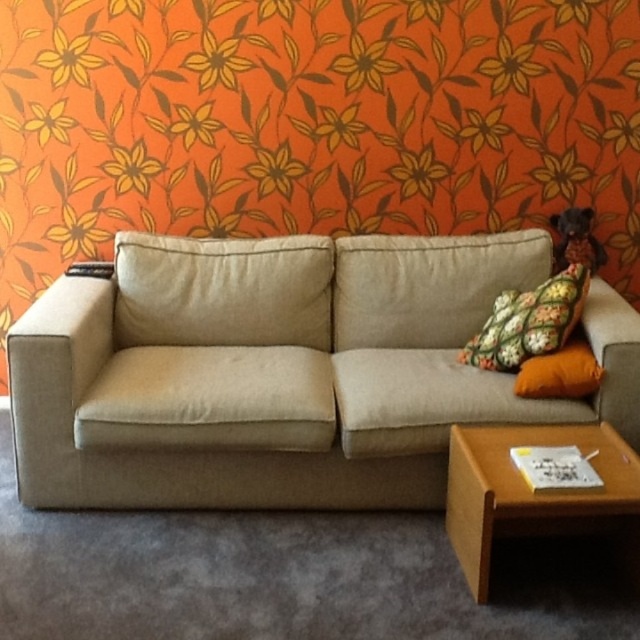
Question: Which point appears farthest from the camera in this image?

Choices:
 (A) (132, 289)
 (B) (508, 356)
 (C) (550, 396)

Answer: (A)

Question: Which point is closer to the camera taking this photo?

Choices:
 (A) (552, 321)
 (B) (77, 392)
 (C) (600, 374)

Answer: (C)

Question: Which object is the farthest from the floral fabric pillow at right?

Choices:
 (A) orange fabric pillow at right
 (B) beige fabric couch at center

Answer: (B)

Question: Is the position of beige fabric couch at center less distant than that of orange fabric pillow at right?

Choices:
 (A) yes
 (B) no

Answer: (A)

Question: Can you confirm if beige fabric couch at center is smaller than orange fabric pillow at right?

Choices:
 (A) no
 (B) yes

Answer: (A)

Question: Can you confirm if beige fabric couch at center is positioned below floral fabric pillow at right?

Choices:
 (A) yes
 (B) no

Answer: (A)